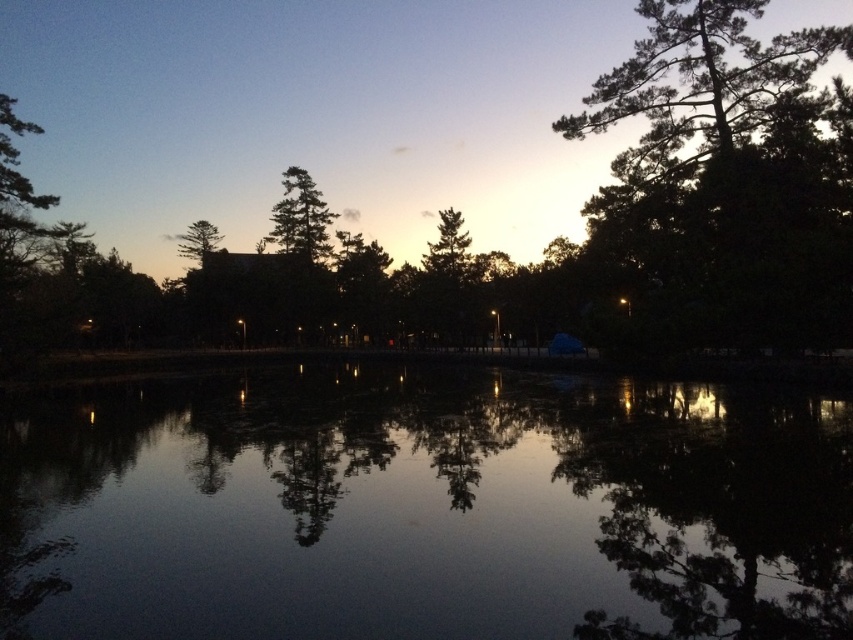
You are standing at the edge of the pond in the park scene and notice two points marked in the image. The first point is at coordinates point (666, 308) and the second is at point (312, 244). Which point is nearer to your current position?

Point (666, 308) is closer to the viewer than point (312, 244).

You are standing at the edge of the water and want to place a small floating lantern on the black reflective water at center. If the lantern requires 2 meters of space to float safely, can you place it there?

The black reflective water at center is 9.49 meters from camera, which is more than enough space for the lantern to float safely as it requires only 2 meters.